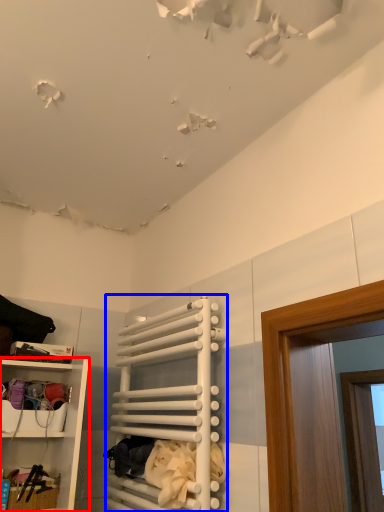
Question: Which object is closer to the camera taking this photo, shelf (highlighted by a red box) or cabinet (highlighted by a blue box)?

Choices:
 (A) shelf
 (B) cabinet

Answer: (B)